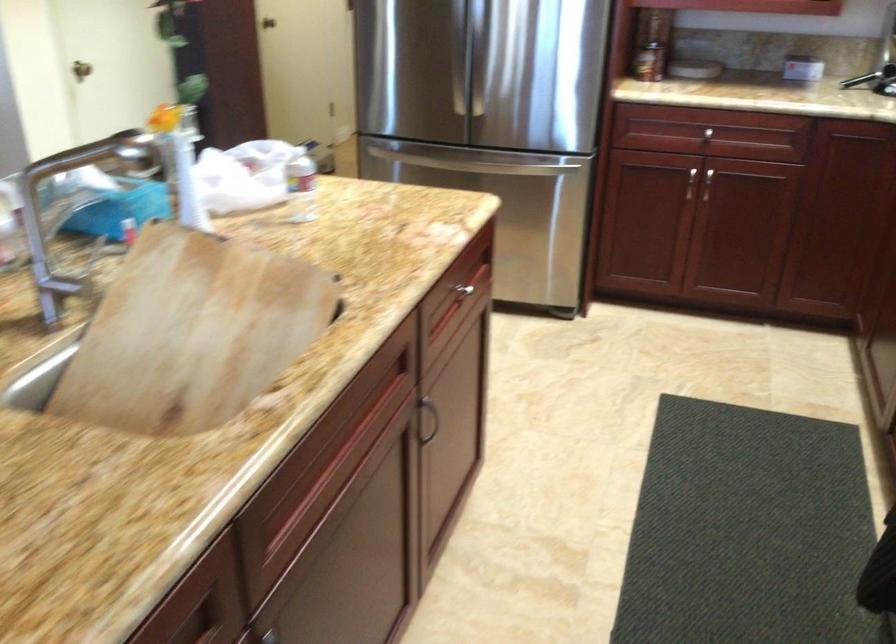
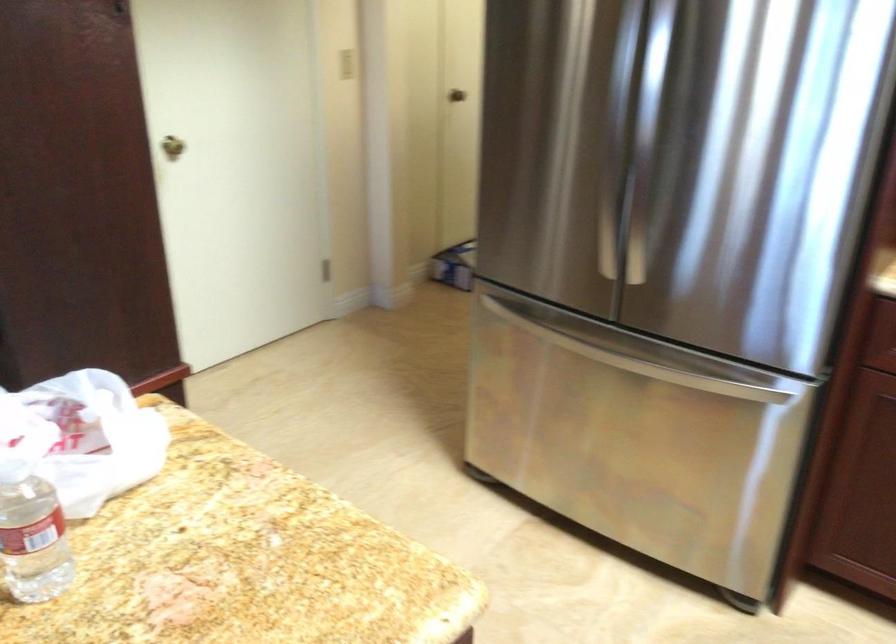
Locate, in the second image, the point that corresponds to (469,156) in the first image.

(607, 355)